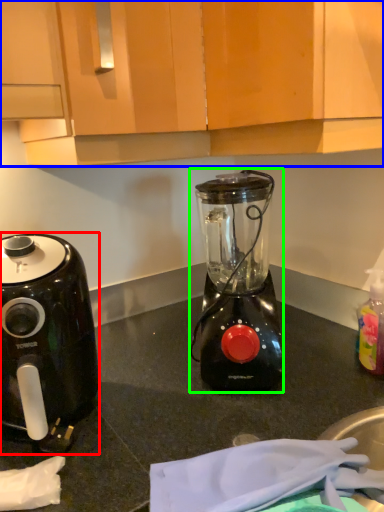
Question: Based on their relative distances, which object is farther from coffee maker (highlighted by a red box)? Choose from cabinetry (highlighted by a blue box) and blender (highlighted by a green box).

Choices:
 (A) cabinetry
 (B) blender

Answer: (A)